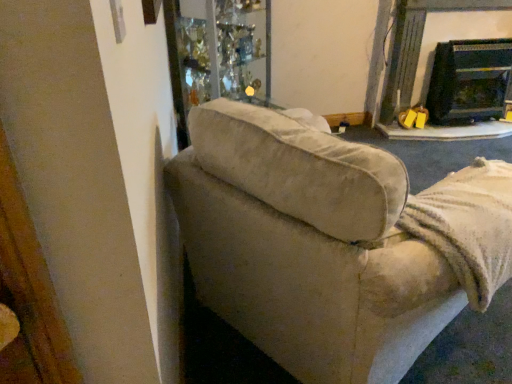
Question: From the image's perspective, would you say black glass fireplace at upper right, placed as the second fireplace when sorted from left to right, is positioned over black glossy fireplace at upper right, the first fireplace from the left?

Choices:
 (A) no
 (B) yes

Answer: (A)

Question: Is black glass fireplace at upper right, placed as the first fireplace when sorted from right to left, taller than black glossy fireplace at upper right, which ranks as the second fireplace in right-to-left order?

Choices:
 (A) no
 (B) yes

Answer: (A)

Question: From a real-world perspective, is black glass fireplace at upper right, placed as the second fireplace when sorted from left to right, beneath black glossy fireplace at upper right, which ranks as the second fireplace in right-to-left order?

Choices:
 (A) yes
 (B) no

Answer: (A)

Question: Is black glass fireplace at upper right, placed as the first fireplace when sorted from right to left, facing towards black glossy fireplace at upper right, the first fireplace from the left?

Choices:
 (A) no
 (B) yes

Answer: (B)

Question: Can black glossy fireplace at upper right, the first fireplace from the left, be found inside black glass fireplace at upper right, placed as the first fireplace when sorted from right to left?

Choices:
 (A) yes
 (B) no

Answer: (B)

Question: Looking at their shapes, would you say beige fabric couch at left is wider or thinner than black glossy fireplace at upper right, which ranks as the second fireplace in right-to-left order?

Choices:
 (A) wide
 (B) thin

Answer: (A)

Question: Relative to black glossy fireplace at upper right, which ranks as the second fireplace in right-to-left order, is beige fabric couch at left in front or behind?

Choices:
 (A) behind
 (B) front

Answer: (B)

Question: From a real-world perspective, is beige fabric couch at left above or below black glossy fireplace at upper right, which ranks as the second fireplace in right-to-left order?

Choices:
 (A) above
 (B) below

Answer: (B)

Question: Would you say beige fabric couch at left is to the left or to the right of black glossy fireplace at upper right, which ranks as the second fireplace in right-to-left order, in the picture?

Choices:
 (A) right
 (B) left

Answer: (B)

Question: From a real-world perspective, is black glossy fireplace at upper right, the first fireplace from the left, positioned above or below beige fabric couch at left?

Choices:
 (A) above
 (B) below

Answer: (A)

Question: Is black glossy fireplace at upper right, the first fireplace from the left, inside the boundaries of beige fabric couch at left, or outside?

Choices:
 (A) inside
 (B) outside

Answer: (B)

Question: In the image, is black glossy fireplace at upper right, the first fireplace from the left, positioned in front of or behind beige fabric couch at left?

Choices:
 (A) front
 (B) behind

Answer: (B)

Question: Does point (392, 84) appear closer or farther from the camera than point (381, 254)?

Choices:
 (A) farther
 (B) closer

Answer: (A)

Question: Does point (486, 62) appear closer or farther from the camera than point (249, 201)?

Choices:
 (A) closer
 (B) farther

Answer: (B)

Question: Based on their positions, is black glass fireplace at upper right, placed as the second fireplace when sorted from left to right, located to the left or right of beige fabric couch at left?

Choices:
 (A) right
 (B) left

Answer: (A)